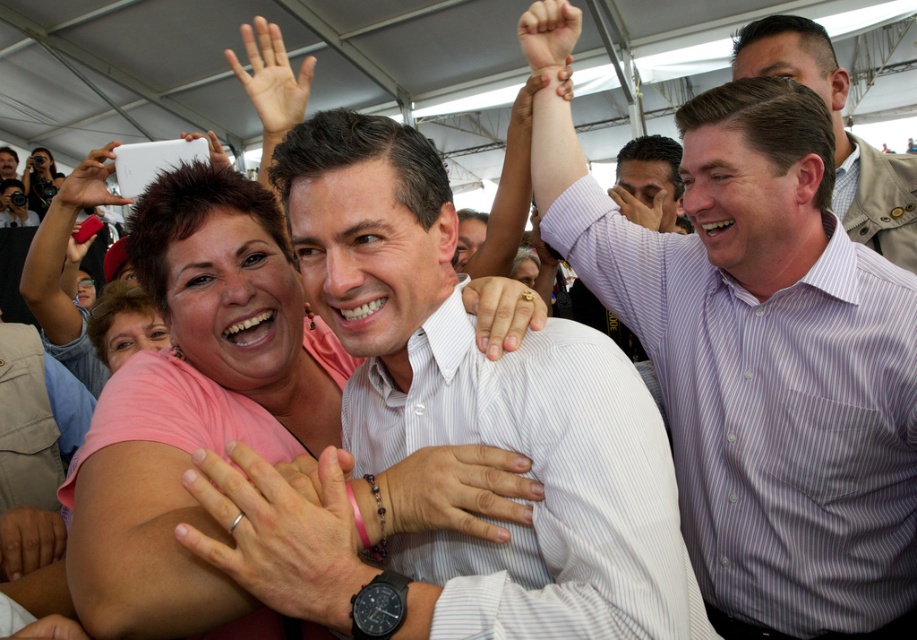
Question: Is pink beaded bracelet at center thinner than white matte phone at upper left?

Choices:
 (A) yes
 (B) no

Answer: (A)

Question: Is pink matte shirt at center above white matte phone at upper left?

Choices:
 (A) yes
 (B) no

Answer: (B)

Question: Which of these objects is positioned closest to the matte skin hand at upper center?

Choices:
 (A) white matte phone at upper left
 (B) gold ring at center
 (C) pink beaded bracelet at center
 (D) pink matte shirt at center

Answer: (B)

Question: Is purple striped shirt at upper right further to camera compared to gold ring at center?

Choices:
 (A) yes
 (B) no

Answer: (A)

Question: Which object appears farthest from the camera in this image?

Choices:
 (A) pink beaded bracelet at center
 (B) white plastic phone at upper left

Answer: (B)

Question: Estimate the real-world distances between objects in this image. Which object is closer to the gold ring at center?

Choices:
 (A) pink matte shirt at center
 (B) matte skin hand at upper center
 (C) pink beaded bracelet at center

Answer: (C)